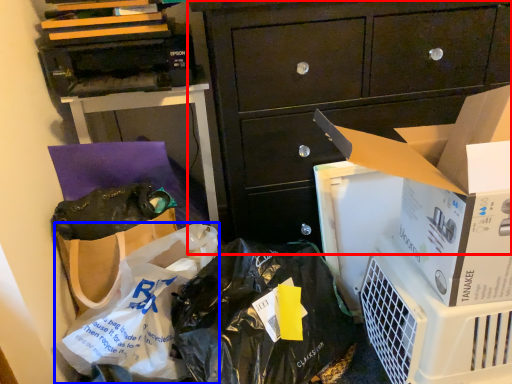
Question: Which point is further to the camera, cabinetry (highlighted by a red box) or plastic bag (highlighted by a blue box)?

Choices:
 (A) cabinetry
 (B) plastic bag

Answer: (A)